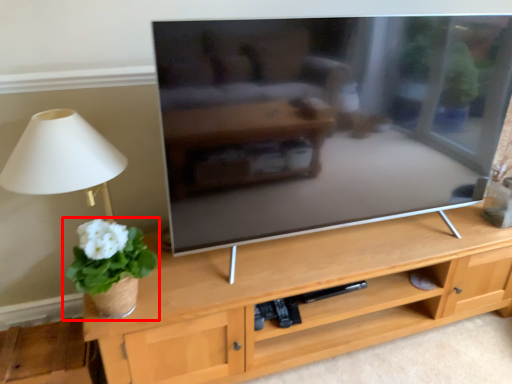
Question: Where is houseplant (annotated by the red box) located in relation to table lamp in the image?

Choices:
 (A) right
 (B) left

Answer: (A)